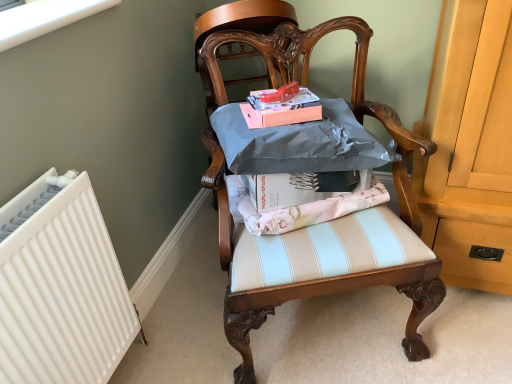
The height and width of the screenshot is (384, 512). I want to click on empty space that is ontop of matte pink magazine at center (from a real-world perspective), so click(x=281, y=94).